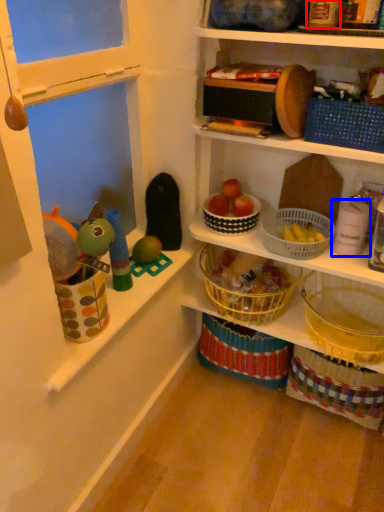
Question: Among these objects, which one is nearest to the camera, toy (highlighted by a red box) or toy (highlighted by a blue box)?

Choices:
 (A) toy
 (B) toy

Answer: (A)